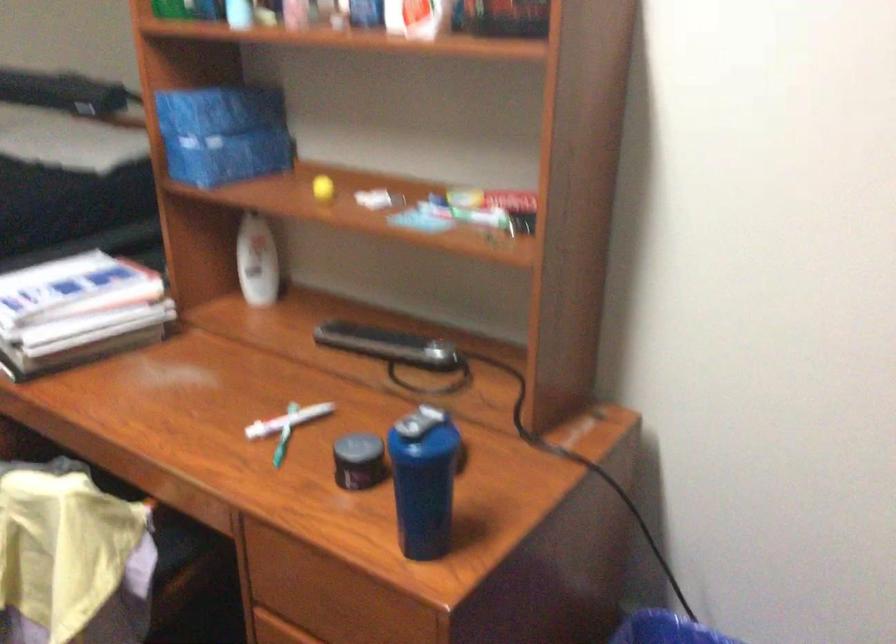
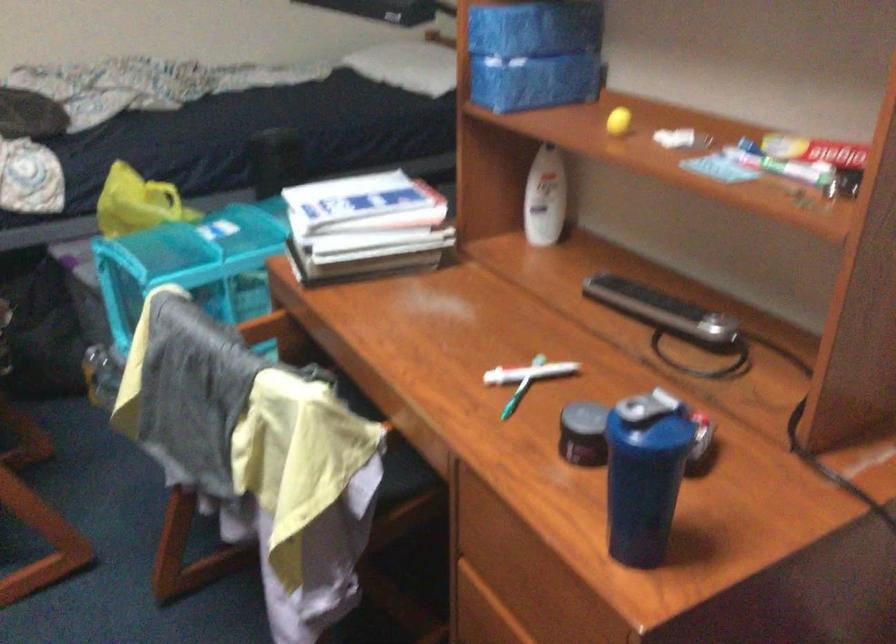
Where in the second image is the point corresponding to (323,184) from the first image?

(617, 120)